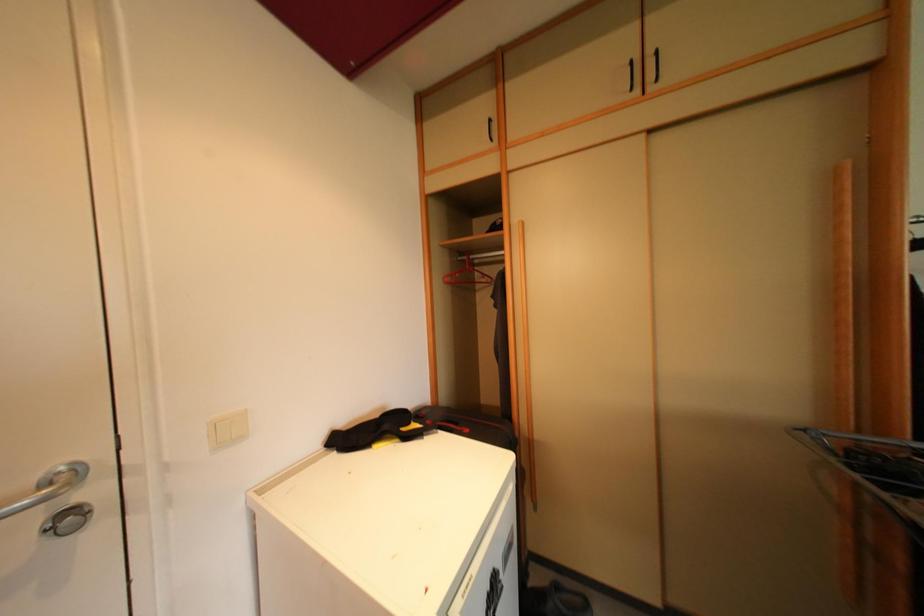
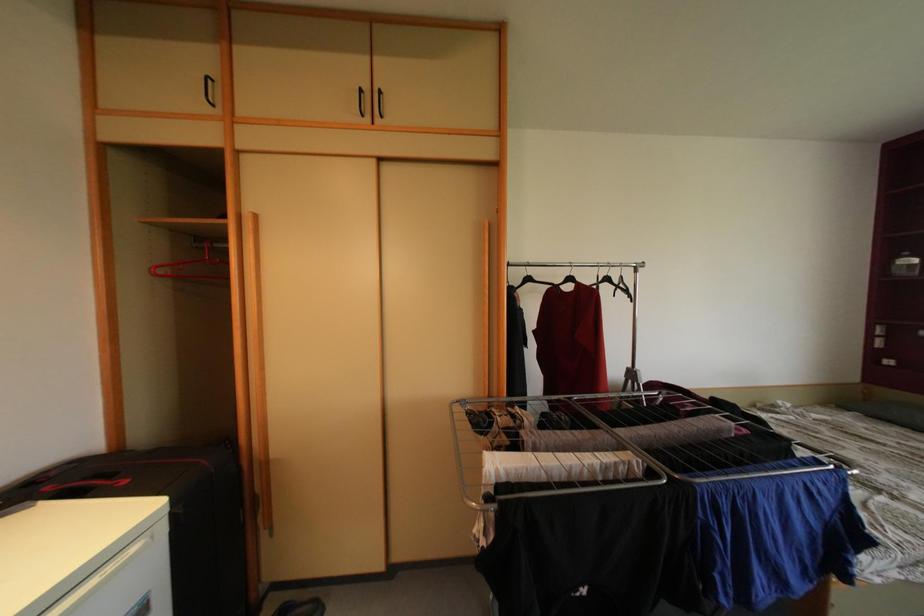
Question: The camera is either moving clockwise (left) or counter-clockwise (right) around the object. The first image is from the beginning of the video and the second image is from the end. Is the camera moving left or right when shooting the video?

Choices:
 (A) Left
 (B) Right

Answer: (A)